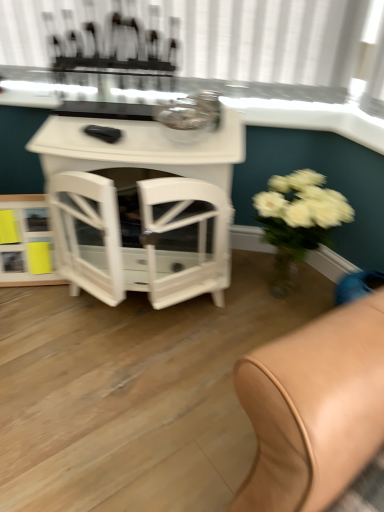
Question: Is white glossy window sill at upper center directly adjacent to white matte vase at right?

Choices:
 (A) yes
 (B) no

Answer: (B)

Question: Is white glossy window sill at upper center not within white matte vase at right?

Choices:
 (A) no
 (B) yes

Answer: (B)

Question: Is white glossy window sill at upper center to the left of white matte vase at right from the viewer's perspective?

Choices:
 (A) yes
 (B) no

Answer: (A)

Question: From a real-world perspective, is white glossy window sill at upper center under white matte vase at right?

Choices:
 (A) yes
 (B) no

Answer: (B)

Question: Is white matte vase at right at the back of white glossy window sill at upper center?

Choices:
 (A) yes
 (B) no

Answer: (B)

Question: Is white glossy window sill at upper center further to camera compared to white matte vase at right?

Choices:
 (A) yes
 (B) no

Answer: (A)

Question: Is clear glass table at upper center in contact with white glossy shelf at lower left?

Choices:
 (A) no
 (B) yes

Answer: (A)

Question: Considering the relative sizes of clear glass table at upper center and white glossy shelf at lower left in the image provided, is clear glass table at upper center bigger than white glossy shelf at lower left?

Choices:
 (A) no
 (B) yes

Answer: (B)

Question: Considering the relative sizes of clear glass table at upper center and white glossy shelf at lower left in the image provided, is clear glass table at upper center taller than white glossy shelf at lower left?

Choices:
 (A) yes
 (B) no

Answer: (A)

Question: Is clear glass table at upper center positioned with its back to white glossy shelf at lower left?

Choices:
 (A) yes
 (B) no

Answer: (B)

Question: Is there a large distance between clear glass table at upper center and white glossy shelf at lower left?

Choices:
 (A) no
 (B) yes

Answer: (A)

Question: From the image's perspective, would you say clear glass table at upper center is positioned over white glossy shelf at lower left?

Choices:
 (A) no
 (B) yes

Answer: (B)

Question: Is white glossy window sill at upper center to the right of clear glass table at upper center from the viewer's perspective?

Choices:
 (A) no
 (B) yes

Answer: (A)